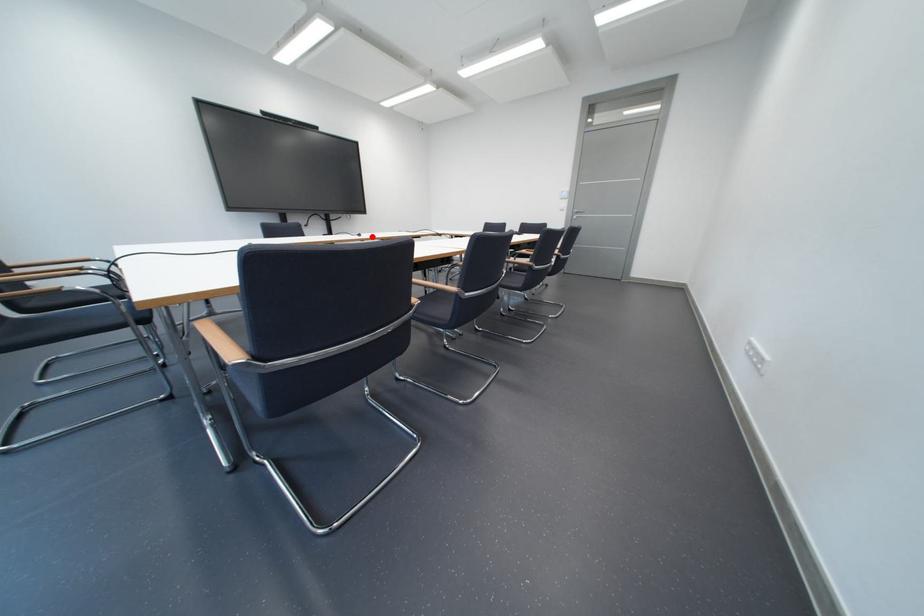
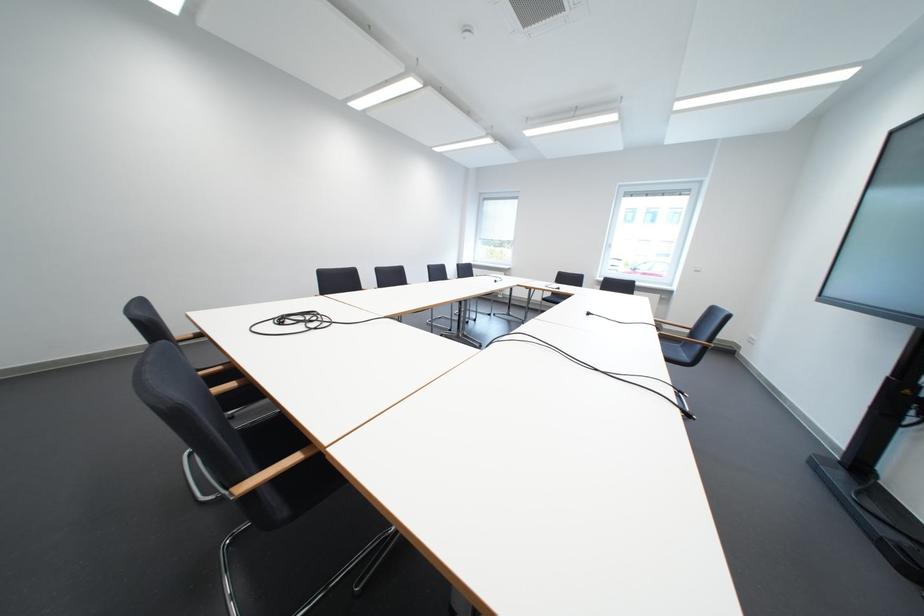
Where in the second image is the point corresponding to the highlighted location from the first image?

(601, 315)